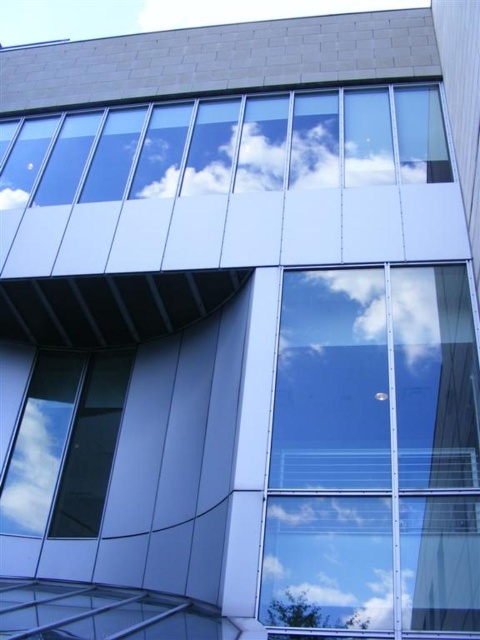
Question: Estimate the real-world distances between objects in this image. Which object is closer to the transparent glass window at upper center?

Choices:
 (A) transparent glass window at lower left
 (B) white fluffy cloud at upper center
 (C) transparent glass window at center
 (D) white fluffy cloud at upper left

Answer: (B)

Question: From the image, what is the correct spatial relationship of white fluffy cloud at center in relation to white fluffy cloud at upper left?

Choices:
 (A) above
 (B) below

Answer: (B)

Question: Considering the relative positions of transparent glass window at center and white fluffy cloud at upper center in the image provided, where is transparent glass window at center located with respect to white fluffy cloud at upper center?

Choices:
 (A) above
 (B) below

Answer: (B)

Question: Which object is positioned farthest from the white fluffy cloud at center?

Choices:
 (A) transparent glass window at lower left
 (B) white fluffy cloud at upper left

Answer: (B)

Question: Which of the following is the farthest from the observer?

Choices:
 (A) (106, 412)
 (B) (337, 349)
 (C) (420, 342)

Answer: (A)

Question: Does transparent glass window at center have a smaller size compared to white fluffy cloud at center?

Choices:
 (A) yes
 (B) no

Answer: (B)